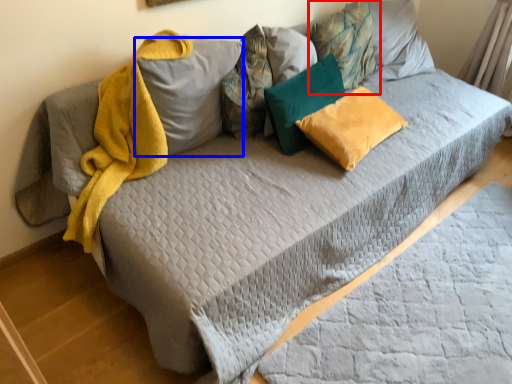
Question: Which point is further to the camera, pillow (highlighted by a red box) or pillow (highlighted by a blue box)?

Choices:
 (A) pillow
 (B) pillow

Answer: (A)